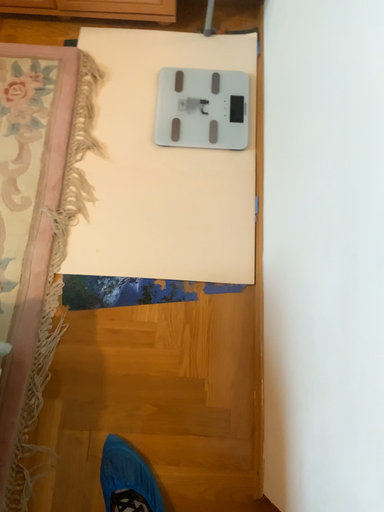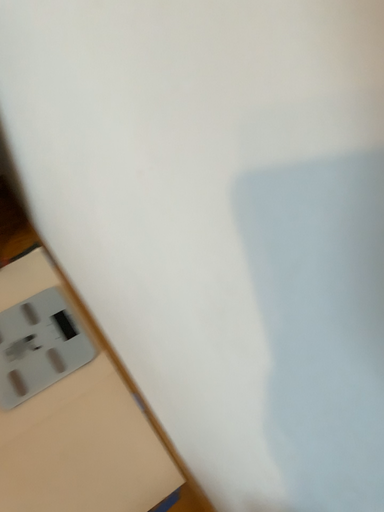
Question: How did the camera likely rotate when shooting the video?

Choices:
 (A) rotated right
 (B) rotated left

Answer: (A)